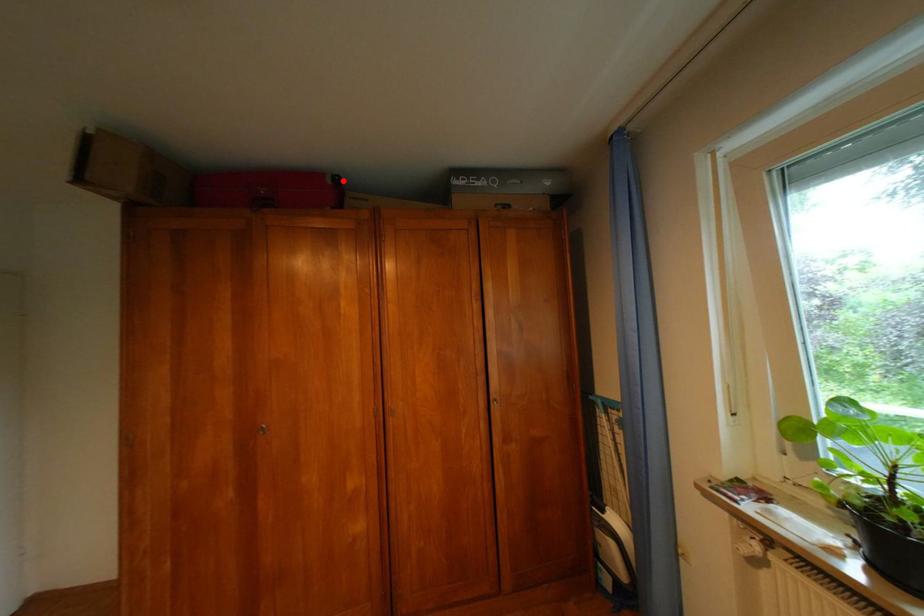
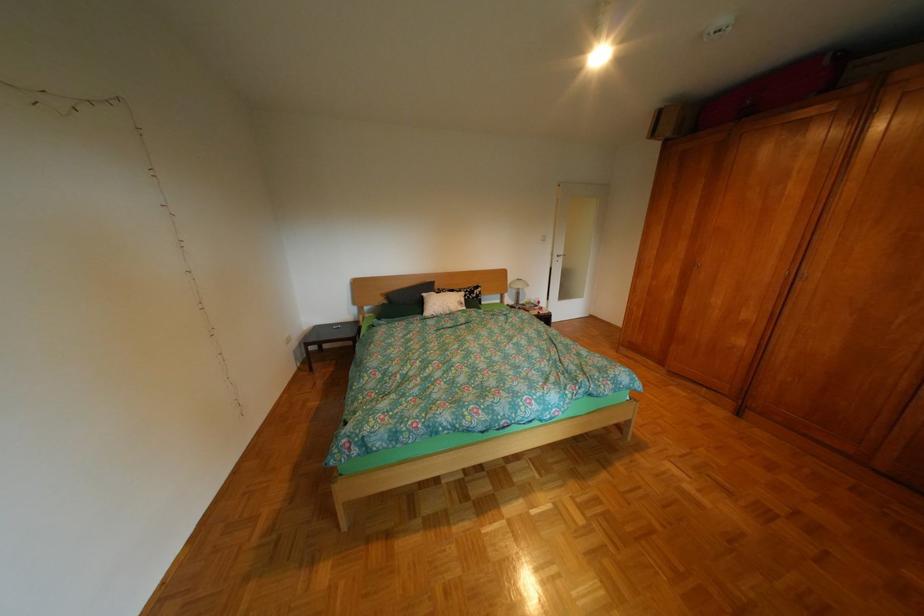
Question: I am providing you with two images of the same scene from different viewpoints. A red point is shown in image1. For the corresponding object point in image2, is it positioned nearer or farther from the camera?

Choices:
 (A) Nearer
 (B) Farther

Answer: (B)